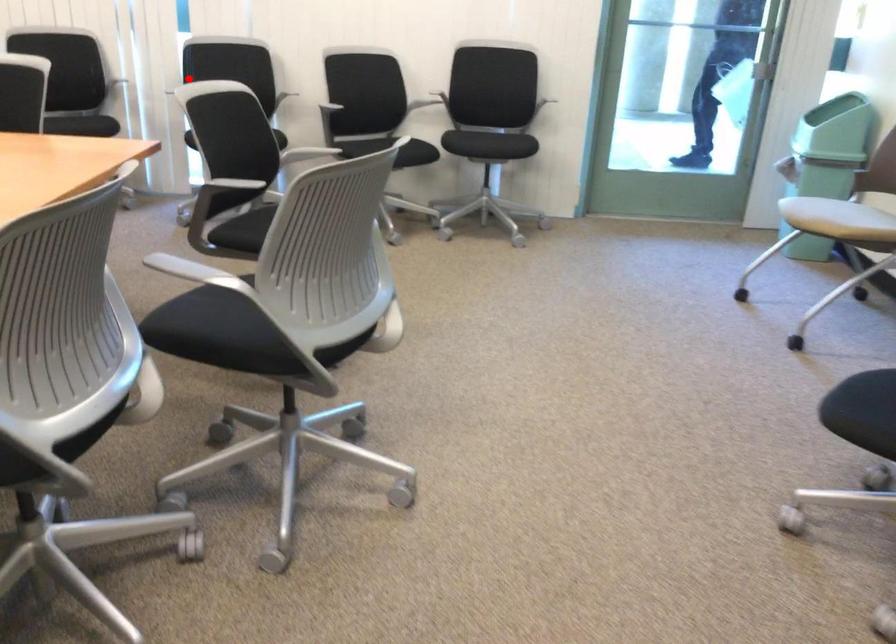
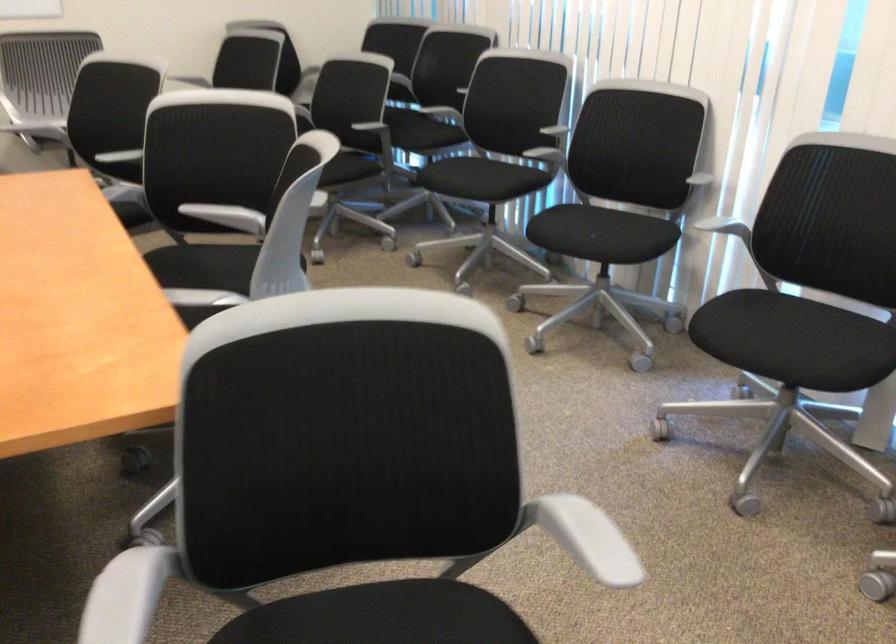
Question: I am providing you with two images of the same scene from different viewpoints. In image1, a red point is highlighted. Considering the same 3D point in image2, which of the following is correct?

Choices:
 (A) It is closer
 (B) It is farther

Answer: (A)